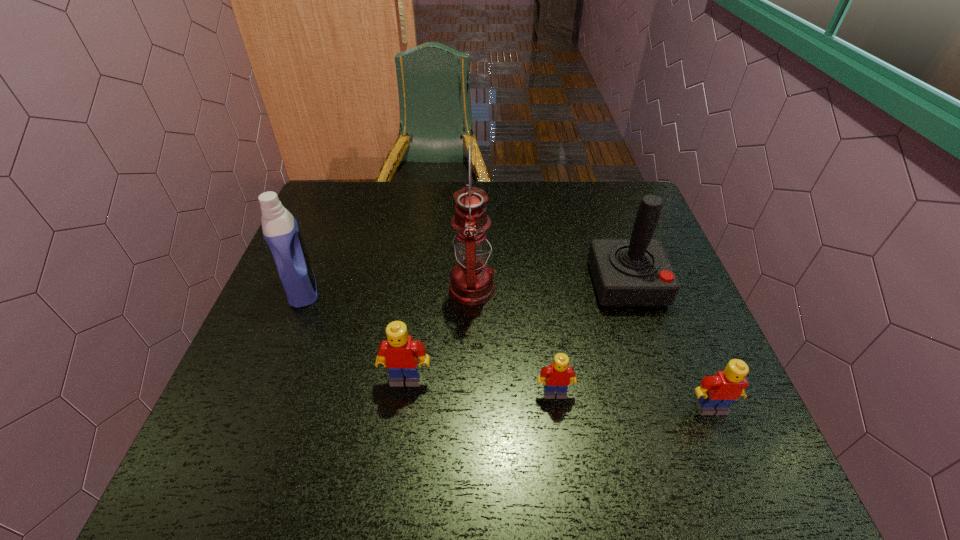
Where is `free space for a new Lego on the left`? This screenshot has width=960, height=540. free space for a new Lego on the left is located at coordinates (265, 366).